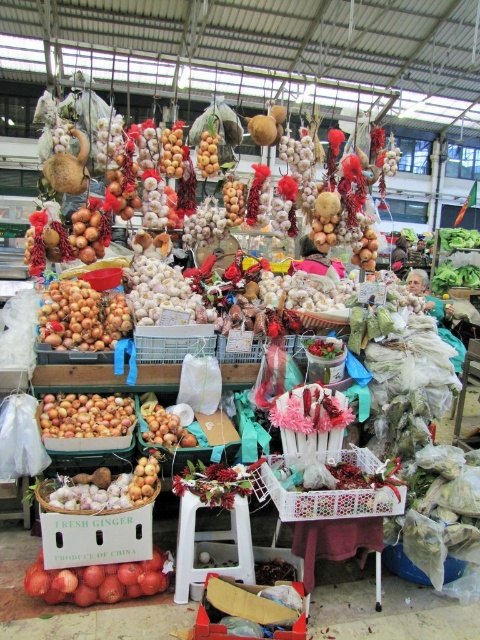
You are a customer at the market looking for onions. You see two types of onions here, the smooth brown onions at center and the smooth yellow onions at center. Which one is located higher up?

The smooth brown onions at center are positioned above the smooth yellow onions at center, so they are higher up.

You are a customer at the market and want to buy both the ripe yellow apples at center and the matte brown onions at center. If you start from the left side of the market, which item should you pick up first to follow the left to right order?

The matte brown onions at center should be picked up first since the ripe yellow apples at center are positioned to the right of them, following the left to right order.

You are a customer at the market and want to grab both the smooth brown onions at center and the smooth yellow onions at center. Which one should you reach for first if you want to pick up the one closer to you?

The smooth brown onions at center are closer to you, so you should reach for them first.